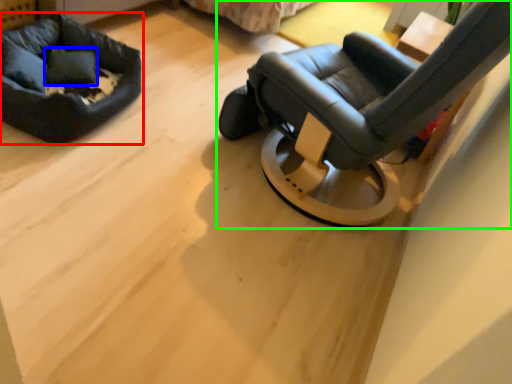
Question: Considering the real-world distances, which object is farthest from dog bed (highlighted by a red box)? pillow (highlighted by a blue box) or chair (highlighted by a green box)?

Choices:
 (A) pillow
 (B) chair

Answer: (B)